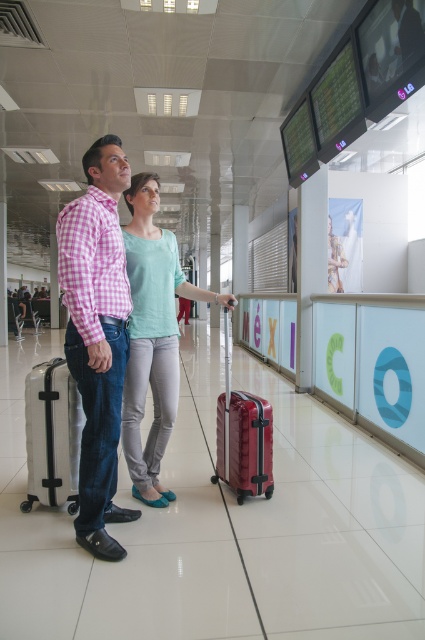
In the scene shown: Between pink checkered shirt at center and matte teal shirt at center, which one has more height?

pink checkered shirt at center

Does pink checkered shirt at center have a greater height compared to matte teal shirt at center?

Indeed, pink checkered shirt at center has a greater height compared to matte teal shirt at center.

The width and height of the screenshot is (425, 640). What do you see at coordinates (96, 336) in the screenshot? I see `pink checkered shirt at center` at bounding box center [96, 336].

The width and height of the screenshot is (425, 640). In order to click on pink checkered shirt at center in this screenshot , I will do `click(96, 336)`.

Can you confirm if black hardshell suitcase at left is taller than matte red suitcase at center?

No, black hardshell suitcase at left is not taller than matte red suitcase at center.

Is black hardshell suitcase at left above matte red suitcase at center?

No.

Is point (76, 400) positioned behind point (258, 486)?

No, (76, 400) is closer to viewer.

Where is `black hardshell suitcase at left`? Image resolution: width=425 pixels, height=640 pixels. black hardshell suitcase at left is located at coordinates (53, 435).

Is pink checkered shirt at center wider than black hardshell suitcase at left?

In fact, pink checkered shirt at center might be narrower than black hardshell suitcase at left.

Does pink checkered shirt at center appear under black hardshell suitcase at left?

No, pink checkered shirt at center is not below black hardshell suitcase at left.

Measure the distance between pink checkered shirt at center and camera.

pink checkered shirt at center is 6.33 feet from camera.

What are the coordinates of `pink checkered shirt at center` in the screenshot? It's located at (96, 336).